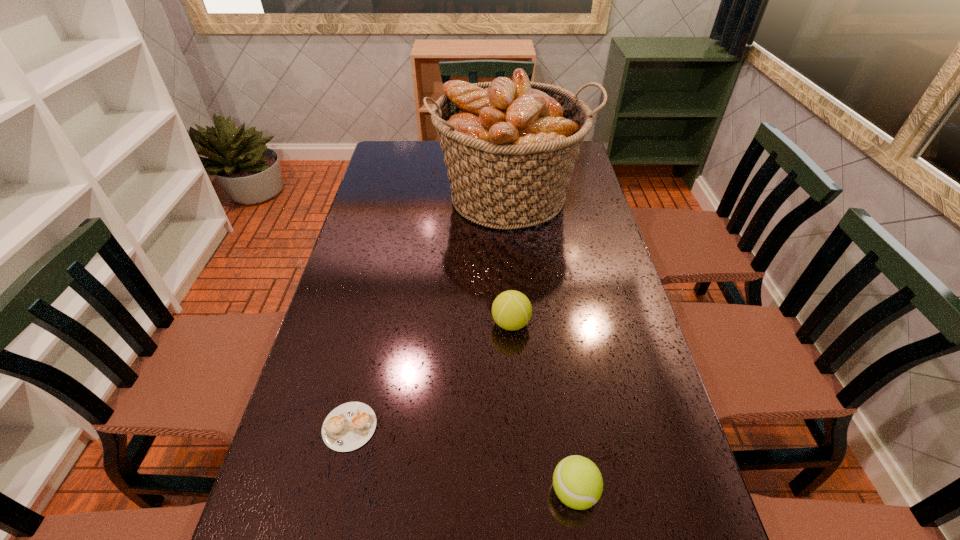
Locate an element on the screen. The image size is (960, 540). free space between the left tennis ball and the tallest object is located at coordinates (511, 260).

Identify the location of free spot between the basket and the farther tennis ball. (511, 260).

Where is `free space that is in between the right tennis ball and the second nearest object`? free space that is in between the right tennis ball and the second nearest object is located at coordinates (462, 459).

I want to click on unoccupied position between the farthest object and the right tennis ball, so click(542, 344).

You are a GUI agent. You are given a task and a screenshot of the screen. Output one action in this format:
    pyautogui.click(x=<x>, y=<y>)
    Task: Click on the free space between the nearer tennis ball and the third nearest object
    
    Given the screenshot: What is the action you would take?
    pos(542,408)

You are a GUI agent. You are given a task and a screenshot of the screen. Output one action in this format:
    pyautogui.click(x=<x>, y=<y>)
    Task: Click on the empty space between the shortest object and the farther tennis ball
    This screenshot has height=540, width=960.
    Given the screenshot: What is the action you would take?
    pyautogui.click(x=430, y=375)

Where is `free spot between the nearest object and the farther tennis ball`? The height and width of the screenshot is (540, 960). free spot between the nearest object and the farther tennis ball is located at coordinates (542, 408).

The height and width of the screenshot is (540, 960). In order to click on empty space that is in between the right tennis ball and the cappuccino in this screenshot , I will do `click(462, 459)`.

Locate an element on the screen. vacant region between the cappuccino and the right tennis ball is located at coordinates (462, 459).

Where is `unoccupied area between the left tennis ball and the nearest object`? This screenshot has width=960, height=540. unoccupied area between the left tennis ball and the nearest object is located at coordinates (542, 408).